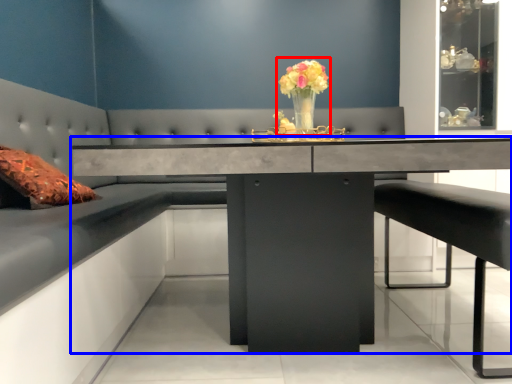
Question: Which point is further to the camera, floral arrangement (highlighted by a red box) or table (highlighted by a blue box)?

Choices:
 (A) floral arrangement
 (B) table

Answer: (A)